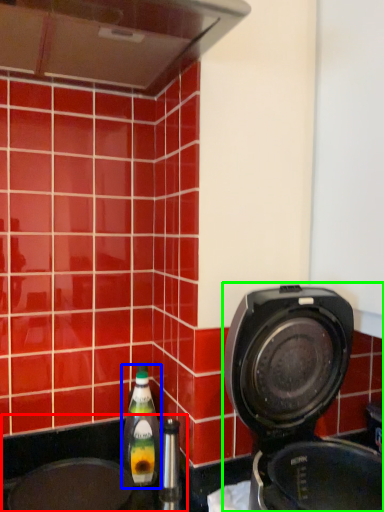
Question: Which object is the farthest from sink (highlighted by a red box)? Choose among these: bottle (highlighted by a blue box) or home appliance (highlighted by a green box).

Choices:
 (A) bottle
 (B) home appliance

Answer: (B)